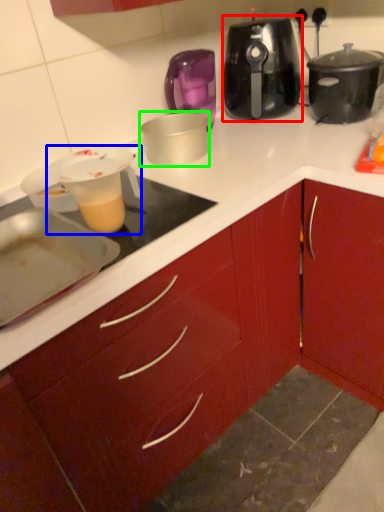
Question: Which object is positioned farthest from slow cooker (highlighted by a red box)? Select from kitchen appliance (highlighted by a blue box) and kitchen appliance (highlighted by a green box).

Choices:
 (A) kitchen appliance
 (B) kitchen appliance

Answer: (A)